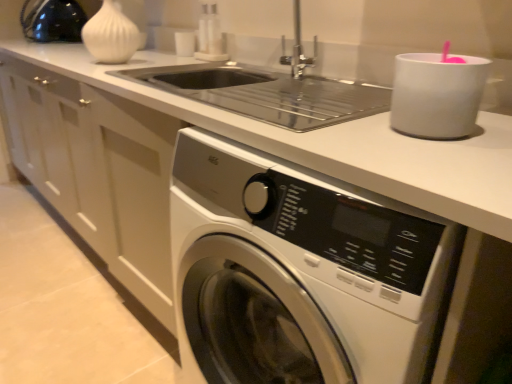
You are a GUI agent. You are given a task and a screenshot of the screen. Output one action in this format:
    pyautogui.click(x=<x>, y=<y>)
    Task: Click on the space that is in front of white matte cup at upper right, positioned as the second appliance in back-to-front order
    This screenshot has width=512, height=384.
    Given the screenshot: What is the action you would take?
    pyautogui.click(x=433, y=156)